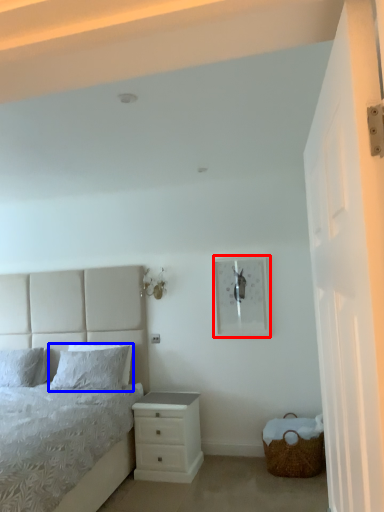
Question: Which object appears farthest to the camera in this image, picture frame (highlighted by a red box) or pillow (highlighted by a blue box)?

Choices:
 (A) picture frame
 (B) pillow

Answer: (B)